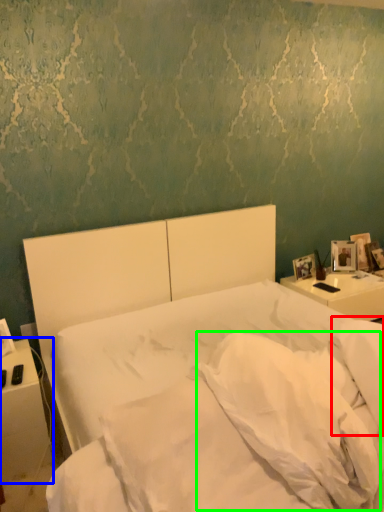
Question: Which object is the closest to the pillow (highlighted by a red box)? Choose among these: nightstand (highlighted by a blue box) or pillow (highlighted by a green box).

Choices:
 (A) nightstand
 (B) pillow

Answer: (B)